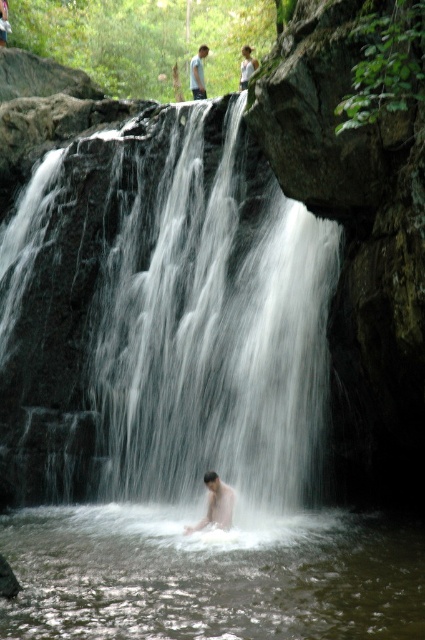
Question: Which object is the closest to the clear water at center?

Choices:
 (A) white smooth waterfall at center
 (B) white cotton shirt at upper center
 (C) light brown skin at upper center
 (D) smooth skin man at center

Answer: (D)

Question: Can you confirm if white smooth waterfall at center is positioned above white cotton shirt at upper center?

Choices:
 (A) no
 (B) yes

Answer: (A)

Question: Does smooth skin man at center appear on the right side of white cotton shirt at upper center?

Choices:
 (A) yes
 (B) no

Answer: (B)

Question: Does light brown skin at upper center have a lesser width compared to white cotton shirt at upper center?

Choices:
 (A) yes
 (B) no

Answer: (B)

Question: Considering the real-world distances, which object is farthest from the white cotton shirt at upper center?

Choices:
 (A) white smooth waterfall at center
 (B) clear water at center
 (C) smooth skin man at center

Answer: (B)

Question: Which point is closer to the camera?

Choices:
 (A) (212, 515)
 (B) (240, 77)
 (C) (192, 76)
 (D) (152, 333)

Answer: (A)